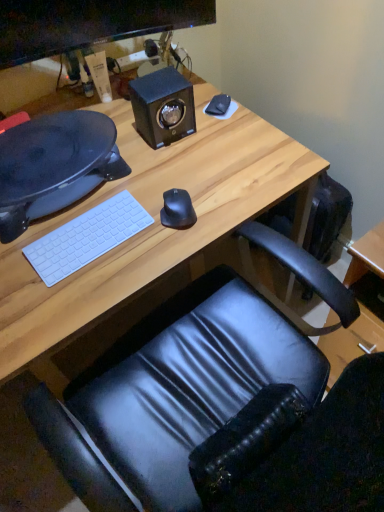
Image resolution: width=384 pixels, height=512 pixels. Find the location of `unoccupied area in front of black matte mouse at center`. unoccupied area in front of black matte mouse at center is located at coordinates (162, 254).